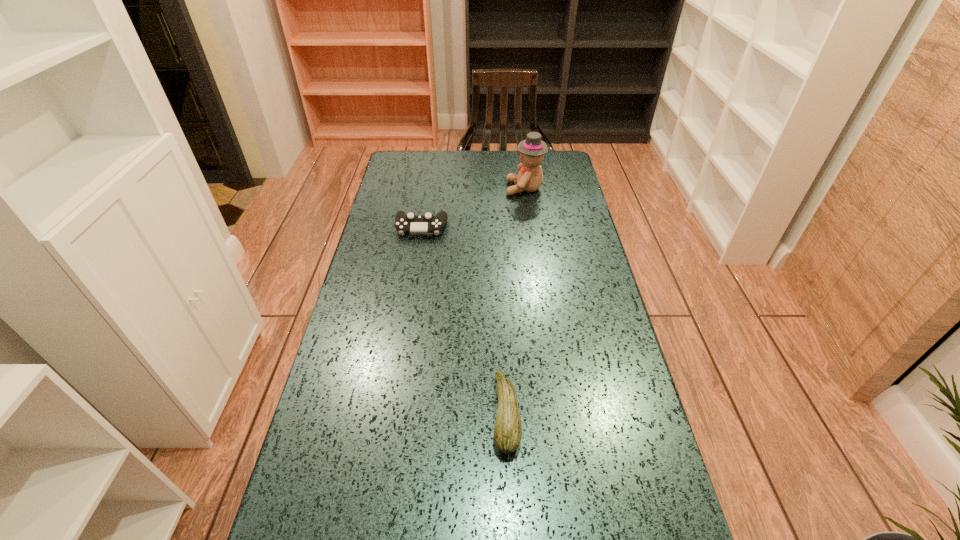
The height and width of the screenshot is (540, 960). Find the location of `vacant space that satisfies the following two spatial constraints: 1. on the front-facing side of the rag_doll; 2. on the surface of the second nearest object`. vacant space that satisfies the following two spatial constraints: 1. on the front-facing side of the rag_doll; 2. on the surface of the second nearest object is located at coordinates (530, 227).

Find the location of `vacant position in the image that satisfies the following two spatial constraints: 1. on the front-facing side of the rightmost object; 2. on the surface of the control`. vacant position in the image that satisfies the following two spatial constraints: 1. on the front-facing side of the rightmost object; 2. on the surface of the control is located at coordinates tap(530, 227).